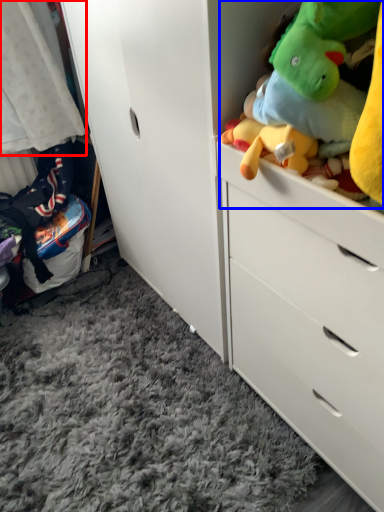
Question: Which of the following is the closest to the observer, baby clothe (highlighted by a red box) or stuff (highlighted by a blue box)?

Choices:
 (A) baby clothe
 (B) stuff

Answer: (B)